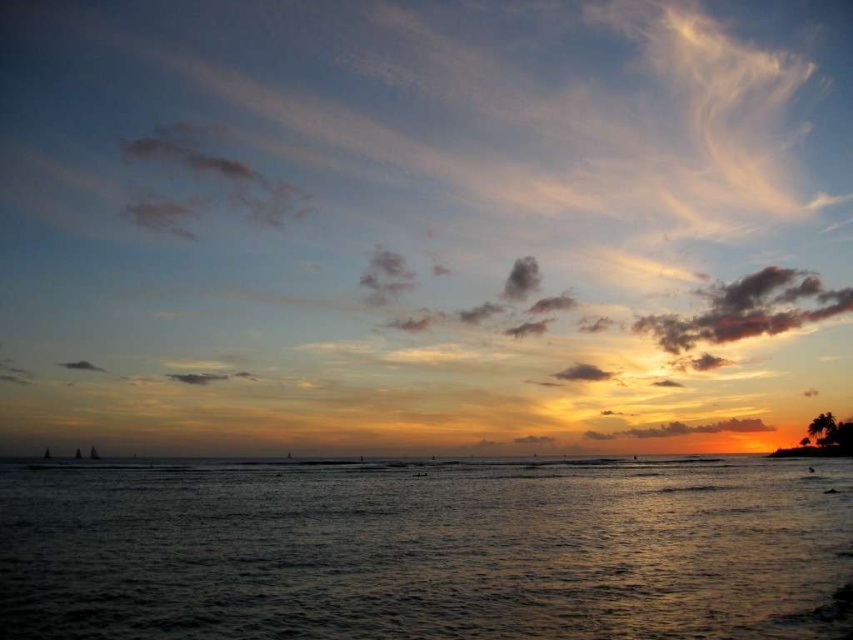
Question: Estimate the real-world distances between objects in this image. Which object is farther from the smokey gray cloud at upper left?

Choices:
 (A) cloudy sky at upper center
 (B) dark gray textured cloud at upper right
 (C) golden-orange cotton cloud at lower right

Answer: (B)

Question: Does dark gray textured cloud at upper right have a larger size compared to smokey gray cloud at upper left?

Choices:
 (A) no
 (B) yes

Answer: (B)

Question: Is the position of dark gray textured cloud at upper right more distant than that of smokey gray cloud at upper left?

Choices:
 (A) no
 (B) yes

Answer: (A)

Question: Which of the following is the closest to the observer?

Choices:
 (A) (842, 296)
 (B) (375, 525)

Answer: (B)

Question: Which point appears farthest from the camera in this image?

Choices:
 (A) (809, 273)
 (B) (144, 552)
 (C) (635, 428)

Answer: (A)

Question: Does dark gray textured cloud at upper right have a smaller size compared to smokey gray cloud at upper left?

Choices:
 (A) no
 (B) yes

Answer: (A)